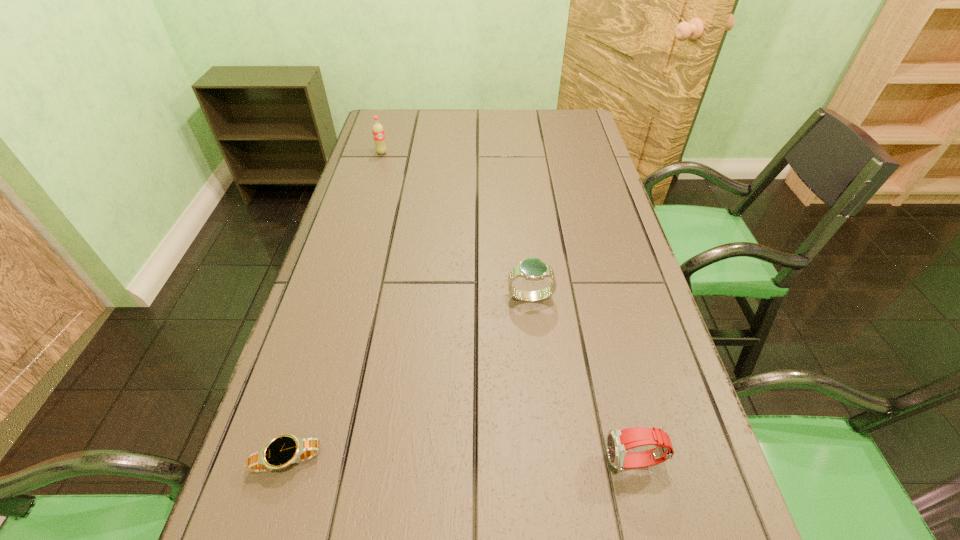
Locate an element on the screen. the farthest object is located at coordinates (378, 131).

Identify the location of soda. (378, 131).

Identify the location of the second object from right to left. (533, 269).

Identify the location of the second watch from right to left. (533, 269).

Where is `the rightmost watch`? the rightmost watch is located at coordinates (619, 441).

Locate an element on the screen. the leftmost watch is located at coordinates (284, 450).

Locate an element on the screen. The image size is (960, 540). the shortest watch is located at coordinates (284, 450).

Image resolution: width=960 pixels, height=540 pixels. In order to click on vacant region located on the front of the farthest object in this screenshot , I will do coord(374,180).

You are a GUI agent. You are given a task and a screenshot of the screen. Output one action in this format:
    pyautogui.click(x=<x>, y=<y>)
    Task: Click on the vacant position located on the front of the farthest watch
    The image size is (960, 540).
    Given the screenshot: What is the action you would take?
    pyautogui.click(x=534, y=336)

Locate an element on the screen. free spot located on the face of the rightmost watch is located at coordinates tap(501, 462).